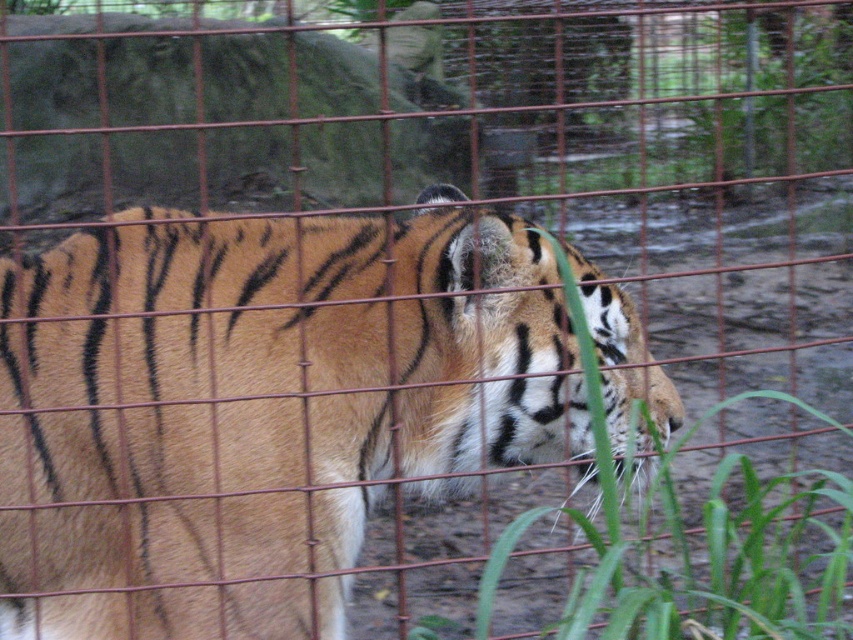
You are a zookeeper who needs to ensure the tiger has enough space to move around. Considering the orange fur tiger at center and the green leafy grass at lower right, which object takes up more area in the enclosure?

The green leafy grass at lower right takes up more area in the enclosure than the orange fur tiger at center because the orange fur tiger at center is smaller than green leafy grass at lower right.